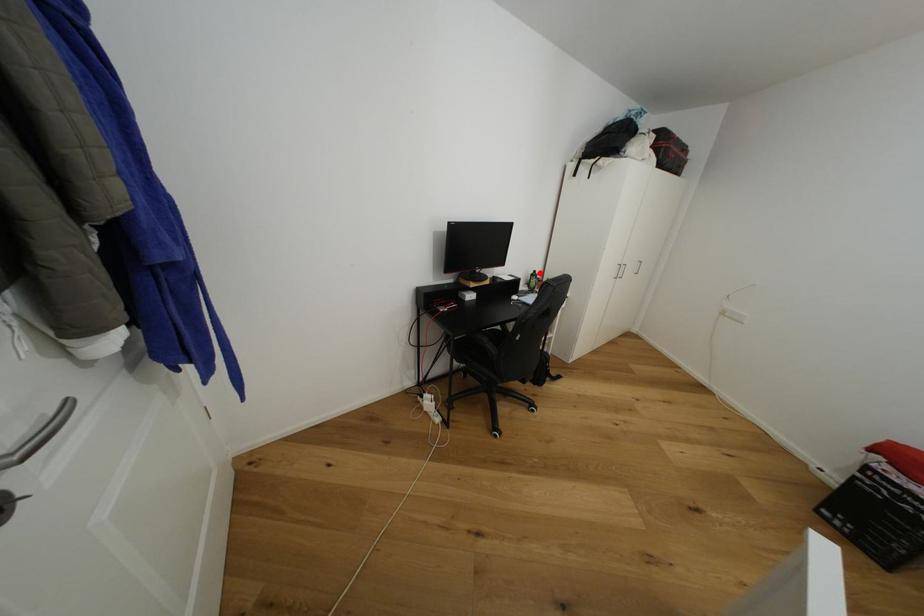
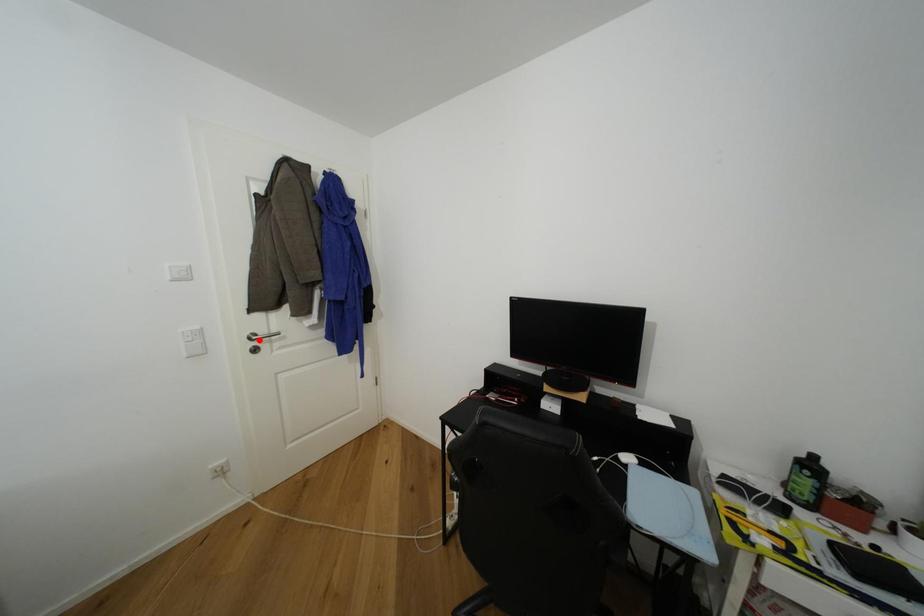
I am providing you with two images of the same scene from different viewpoints. A red point is marked on the first image and another point is marked on the second image. Is the marked point in image1 the same physical position as the marked point in image2?

No